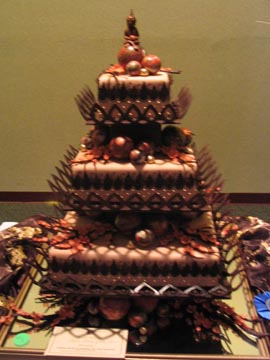
At what (x,y) coordinates should I click in order to perform the action: click on figurine. Please return your answer as a coordinate pair (x, y). The image size is (270, 360). Looking at the image, I should click on (131, 23).